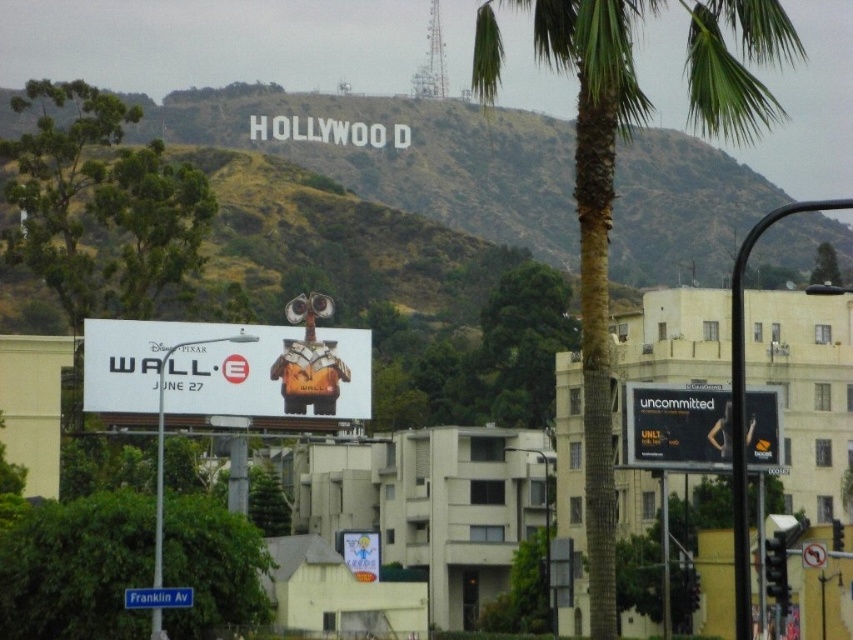
Does green leafy tree at upper left lie in front of blue plastic street sign at lower left?

No, it is behind blue plastic street sign at lower left.

Does point (84, 212) lie behind point (172, 595)?

Yes.

Does point (61, 291) come closer to viewer compared to point (131, 588)?

No, (61, 291) is behind (131, 588).

In order to click on green leafy tree at upper left in this screenshot , I will do `click(102, 204)`.

Between green textured palm tree at center and black glossy billboard at right, which one appears on the right side from the viewer's perspective?

From the viewer's perspective, green textured palm tree at center appears more on the right side.

Based on the photo, does green textured palm tree at center have a lesser width compared to black glossy billboard at right?

Incorrect, green textured palm tree at center's width is not less than black glossy billboard at right's.

You are a GUI agent. You are given a task and a screenshot of the screen. Output one action in this format:
    pyautogui.click(x=<x>, y=<y>)
    Task: Click on the green textured palm tree at center
    This screenshot has height=640, width=853.
    Given the screenshot: What is the action you would take?
    pyautogui.click(x=585, y=216)

Where is `green textured palm tree at center`? The height and width of the screenshot is (640, 853). green textured palm tree at center is located at coordinates (585, 216).

Does point (231, 356) lie in front of point (131, 595)?

No, it is not.

Which is behind, point (99, 326) or point (166, 602)?

Positioned behind is point (99, 326).

I want to click on metallic robot at center, so click(225, 369).

Locate an element on the screen. This screenshot has width=853, height=640. metallic robot at center is located at coordinates (225, 369).